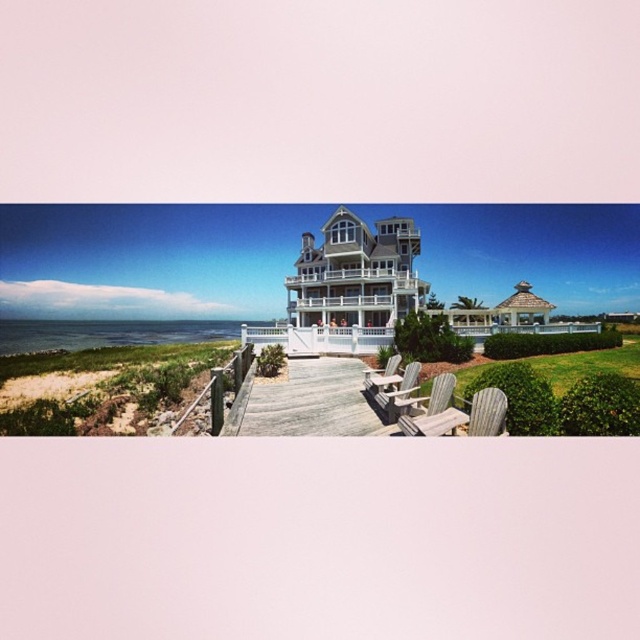
You are standing at the entrance of the coastal house and want to take a photo of both the point at coordinates point (490, 416) and point (388, 372). Since you want both points to be clearly visible in the frame, which point should you focus on to ensure both are in focus?

You should focus on point (388, 372) because it is farther away from the camera than point (490, 416). By focusing on the farther point, both points will be within the depth of field and clearly visible.

You are standing on the wooden walkway leading to the house and want to sit down. Which wooden beach chair should you choose if you want to sit closer to the house? The options are the wooden beach chair at center and the wooden beach chair at lower center.

The wooden beach chair at center is below the wooden beach chair at lower center, so the wooden beach chair at center is closer to the house. You should choose the wooden beach chair at center.